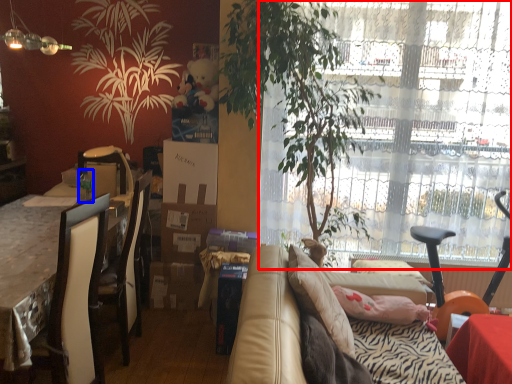
Question: Which point is closer to the camera, window (highlighted by a red box) or bottle (highlighted by a blue box)?

Choices:
 (A) window
 (B) bottle

Answer: (A)